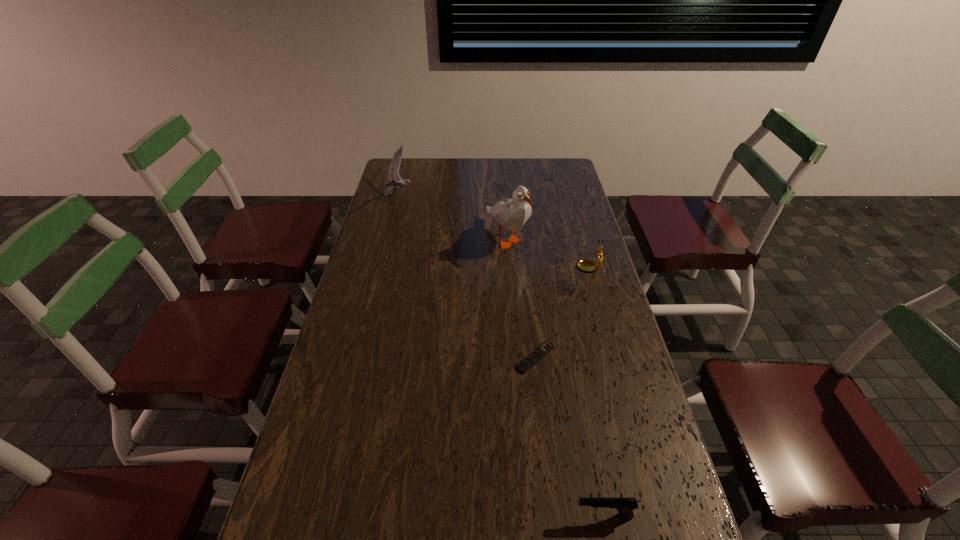
This screenshot has height=540, width=960. What are the coordinates of `the right gull` in the screenshot? It's located at coord(512,213).

Identify the location of the taller gull. (512, 213).

You are a GUI agent. You are given a task and a screenshot of the screen. Output one action in this format:
    pyautogui.click(x=<x>, y=<y>)
    Task: Click on the shorter gull
    
    Given the screenshot: What is the action you would take?
    pyautogui.click(x=396, y=182)

This screenshot has width=960, height=540. Find the location of `the leftmost object`. the leftmost object is located at coordinates (396, 182).

The height and width of the screenshot is (540, 960). Find the location of `pocket watch`. pocket watch is located at coordinates (587, 265).

At what (x,y) coordinates should I click in order to perform the action: click on the rightmost object. Please return your answer as a coordinate pair (x, y). This screenshot has height=540, width=960. Looking at the image, I should click on (587, 265).

Identify the location of pistol. (625, 506).

At what (x,y) coordinates should I click in order to perform the action: click on the fourth tallest object. Please return your answer as a coordinate pair (x, y). Looking at the image, I should click on (625, 506).

This screenshot has height=540, width=960. Find the location of `the second nearest object`. the second nearest object is located at coordinates pyautogui.click(x=533, y=358).

This screenshot has height=540, width=960. I want to click on remote control, so pos(533,358).